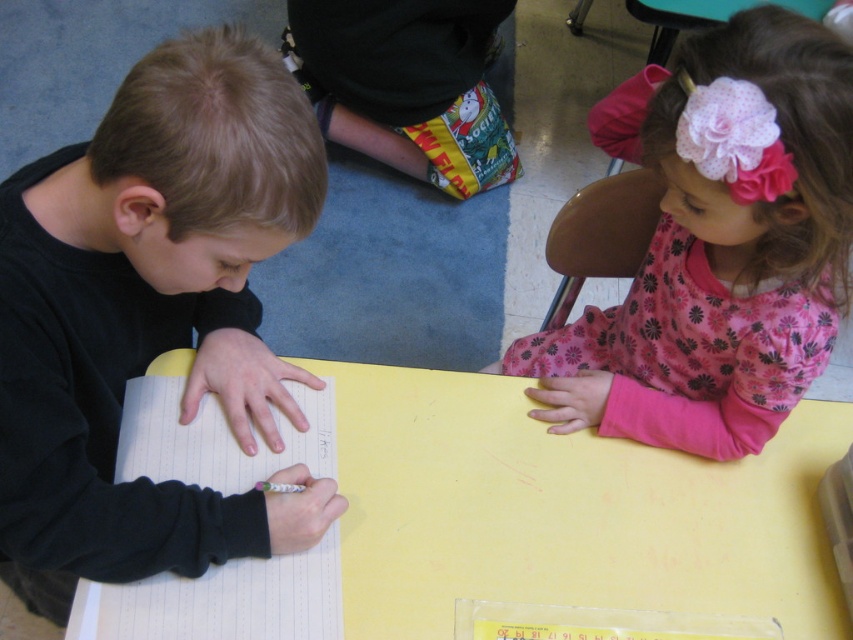
How far apart are yellow matte table at center and pink floral dress at upper right?

yellow matte table at center is 8.72 inches from pink floral dress at upper right.

This screenshot has height=640, width=853. Find the location of `yellow matte table at center`. yellow matte table at center is located at coordinates (566, 509).

The image size is (853, 640). Identify the location of yellow matte table at center. (566, 509).

Is black matte shirt at left wider than yellow matte table at center?

No, black matte shirt at left is not wider than yellow matte table at center.

Who is more distant from viewer, (277,371) or (705,563)?

Positioned behind is point (277,371).

Who is more forward, (148,259) or (532,433)?

Positioned in front is point (148,259).

Where is `black matte shirt at left`? This screenshot has width=853, height=640. black matte shirt at left is located at coordinates (151, 316).

Who is shorter, white paper notebook at left or printed fabric pants at center?

With less height is white paper notebook at left.

Find the location of a particular element. white paper notebook at left is located at coordinates (219, 600).

The image size is (853, 640). I want to click on white paper notebook at left, so click(219, 600).